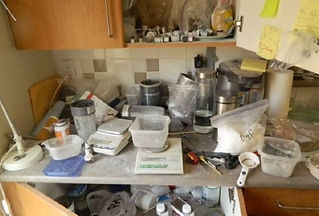
Locate an element on the screen. The width and height of the screenshot is (319, 216). paper towels is located at coordinates (281, 91).